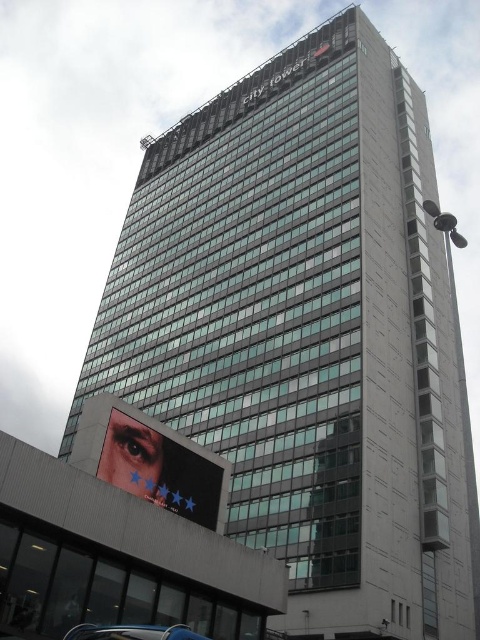
In the scene shown: Does matte black eye at lower left have a lesser height compared to metallic blue car at lower left?

No, matte black eye at lower left is not shorter than metallic blue car at lower left.

From the picture: Is the position of matte black eye at lower left less distant than that of metallic blue car at lower left?

No, it is behind metallic blue car at lower left.

This screenshot has height=640, width=480. Describe the element at coordinates (163, 470) in the screenshot. I see `matte black eye at lower left` at that location.

Where is `matte black eye at lower left`? Image resolution: width=480 pixels, height=640 pixels. matte black eye at lower left is located at coordinates (163, 470).